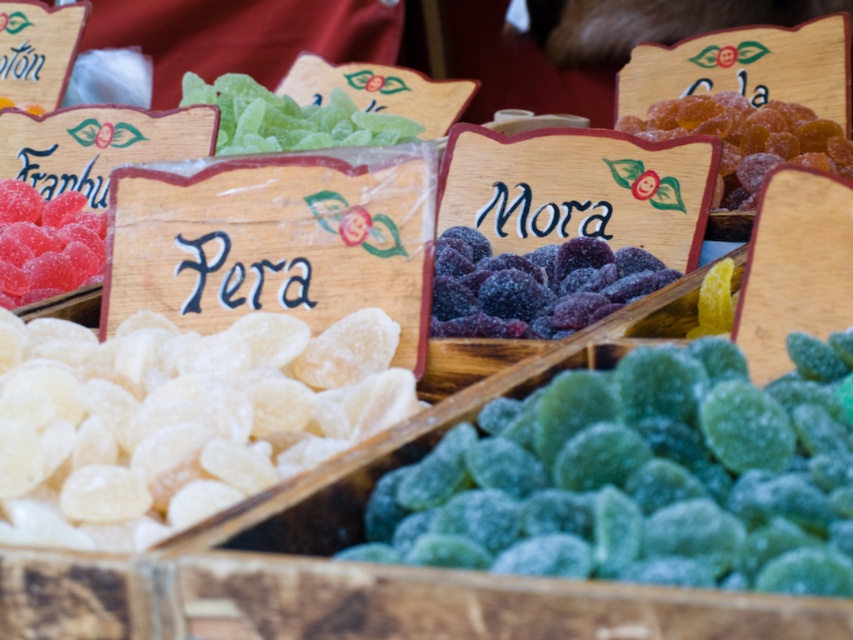
Question: Does glossy amber gummy at upper right lie in front of glossy pink candy at upper left?

Choices:
 (A) no
 (B) yes

Answer: (A)

Question: Based on their relative distances, which object is farther from the purple sugared candy at center?

Choices:
 (A) glossy amber gummy at upper right
 (B) green sugared candy at center
 (C) glossy pink candy at upper left

Answer: (C)

Question: In this image, where is purple sugared candy at center located relative to glossy pink candy at upper left?

Choices:
 (A) right
 (B) left

Answer: (A)

Question: Can you confirm if green sugared candy at center is smaller than glossy amber gummy at upper right?

Choices:
 (A) no
 (B) yes

Answer: (B)

Question: Considering the real-world distances, which object is closest to the glossy pink candy at upper left?

Choices:
 (A) purple sugared candy at center
 (B) glossy amber gummy at upper right

Answer: (A)

Question: Which of the following is the farthest from the observer?

Choices:
 (A) (695, 115)
 (B) (532, 257)
 (C) (654, 454)
 (D) (99, 227)

Answer: (A)